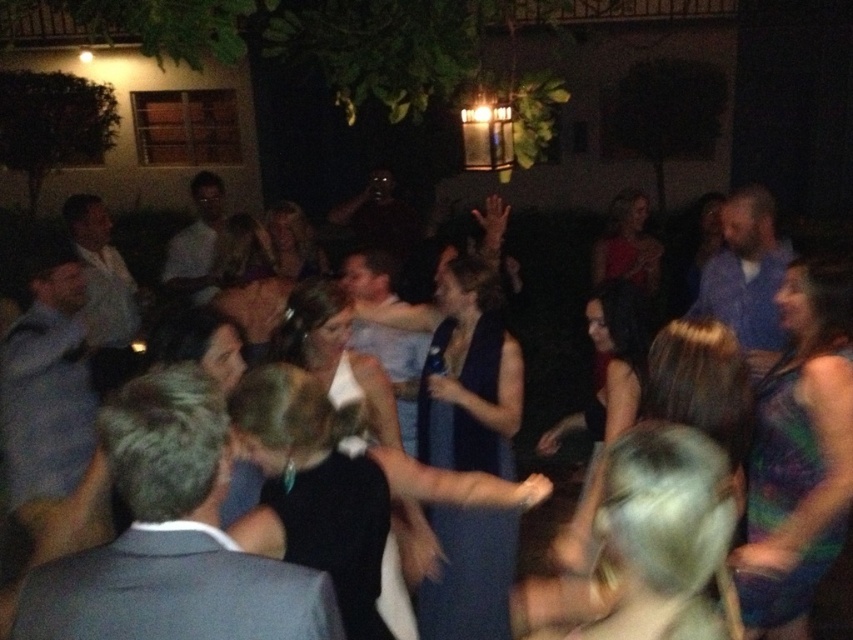
Who is shorter, green satin dress at lower right or blue dress at center?

blue dress at center

Consider the image. Which is more to the left, green satin dress at lower right or blue dress at center?

blue dress at center

Locate an element on the screen. This screenshot has width=853, height=640. green satin dress at lower right is located at coordinates (779, 452).

Is dark blue satin dress at center bigger than green satin dress at lower right?

Actually, dark blue satin dress at center might be smaller than green satin dress at lower right.

Describe the element at coordinates (468, 573) in the screenshot. I see `dark blue satin dress at center` at that location.

Identify the location of dark blue satin dress at center. This screenshot has height=640, width=853. (468, 573).

Who is lower down, dark blue satin dress at center or blue dress at center?

Positioned lower is blue dress at center.

Can you confirm if dark blue satin dress at center is positioned below blue dress at center?

Actually, dark blue satin dress at center is above blue dress at center.

Is point (486, 540) positioned before point (503, 234)?

Yes, it is in front of point (503, 234).

At what (x,y) coordinates should I click in order to perform the action: click on dark blue satin dress at center. Please return your answer as a coordinate pair (x, y). Looking at the image, I should click on (468, 573).